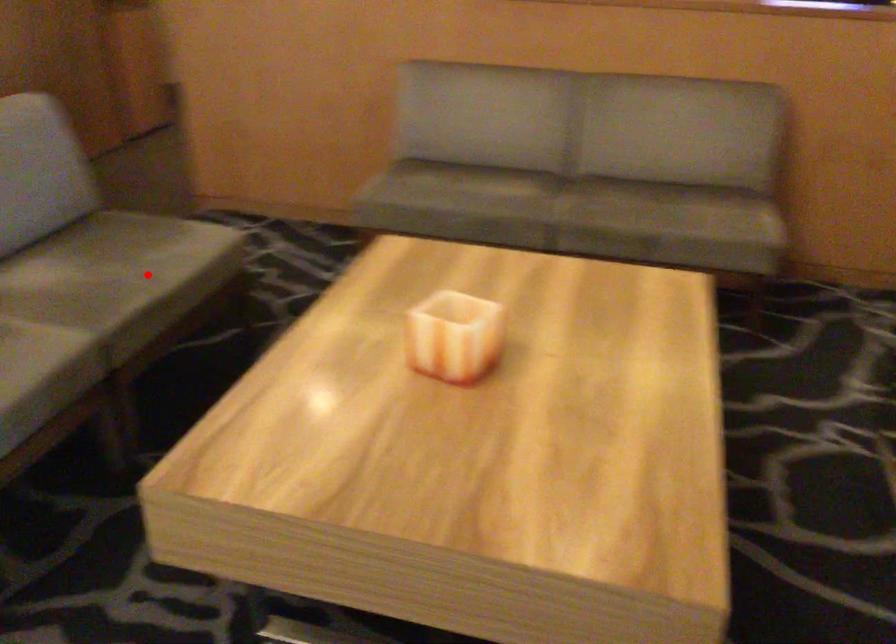
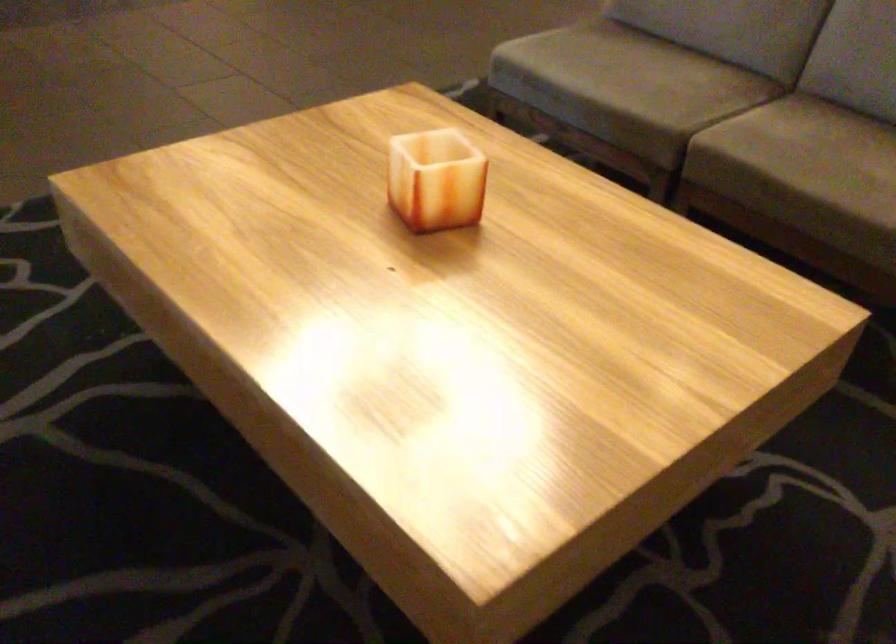
The point at the highlighted location is marked in the first image. Where is the corresponding point in the second image?

(800, 161)